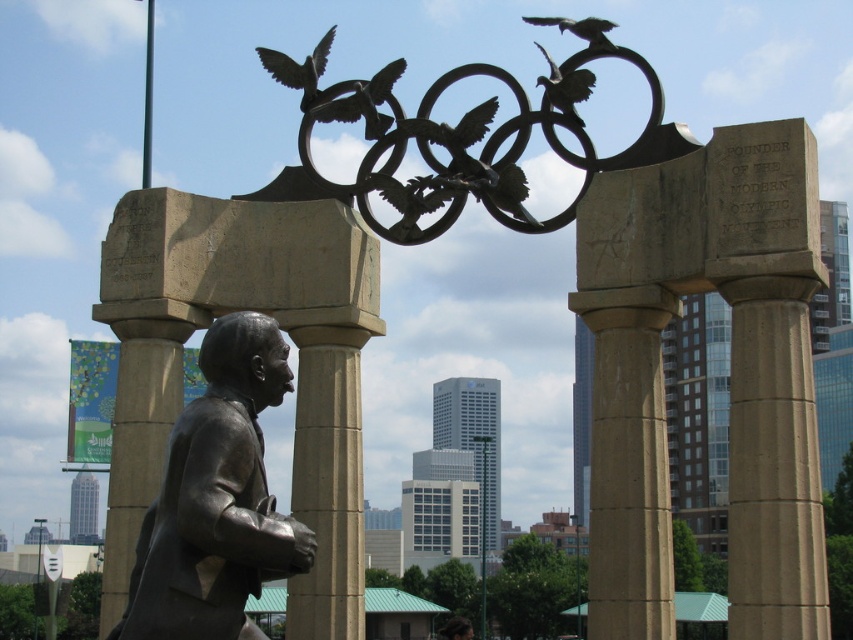
Question: Is black metal olympic rings at center below dark brown feathers at upper center?

Choices:
 (A) yes
 (B) no

Answer: (A)

Question: From the image, what is the correct spatial relationship of black metal olympic rings at center in relation to bronze sculpture of bird at upper center?

Choices:
 (A) right
 (B) left

Answer: (A)

Question: Which is nearer to the bronze sculpture of bird at upper center?

Choices:
 (A) black metal olympic rings at center
 (B) shiny silver bird at upper center
 (C) bronze textured bird at upper center
 (D) bronze statue at left

Answer: (B)

Question: Which of the following is the farthest from the observer?

Choices:
 (A) (561, 22)
 (B) (577, 72)
 (C) (207, 595)
 (D) (404, 189)

Answer: (D)

Question: Does bronze textured eagle at upper center have a greater width compared to shiny silver bird at upper center?

Choices:
 (A) yes
 (B) no

Answer: (B)

Question: Which point is farther to the camera?

Choices:
 (A) black metal olympic rings at center
 (B) bronze statue at left

Answer: (A)